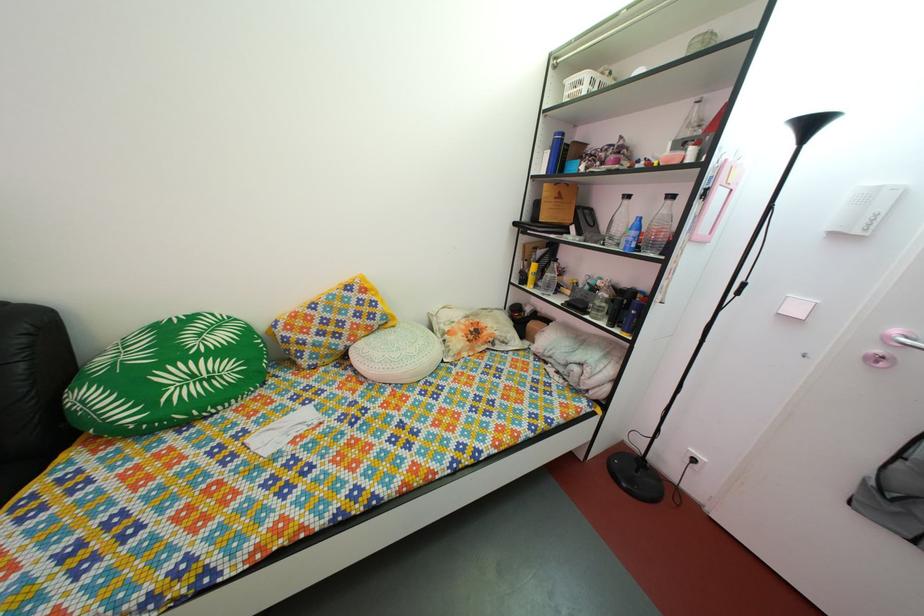
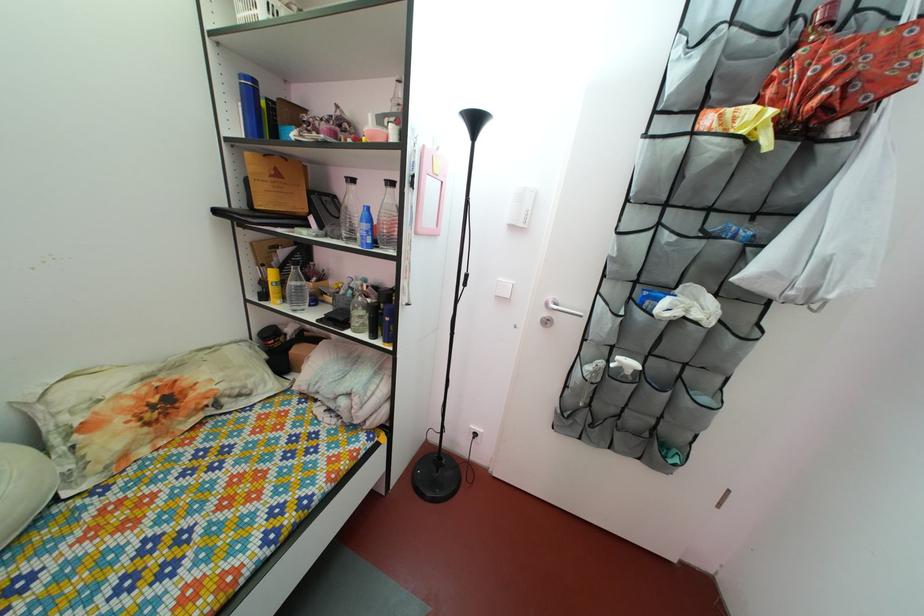
In the second image, find the point that corresponds to the point at 549,261 in the first image.

(292, 262)